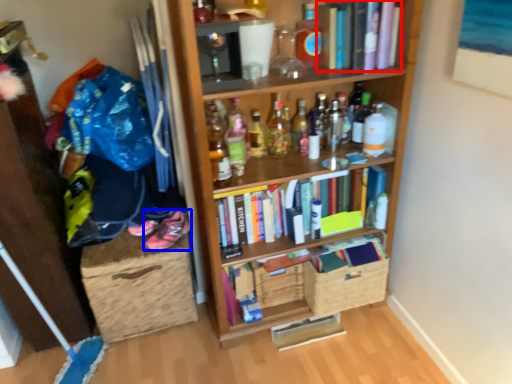
Question: Which object is closer to the camera taking this photo, book (highlighted by a red box) or footwear (highlighted by a blue box)?

Choices:
 (A) book
 (B) footwear

Answer: (A)